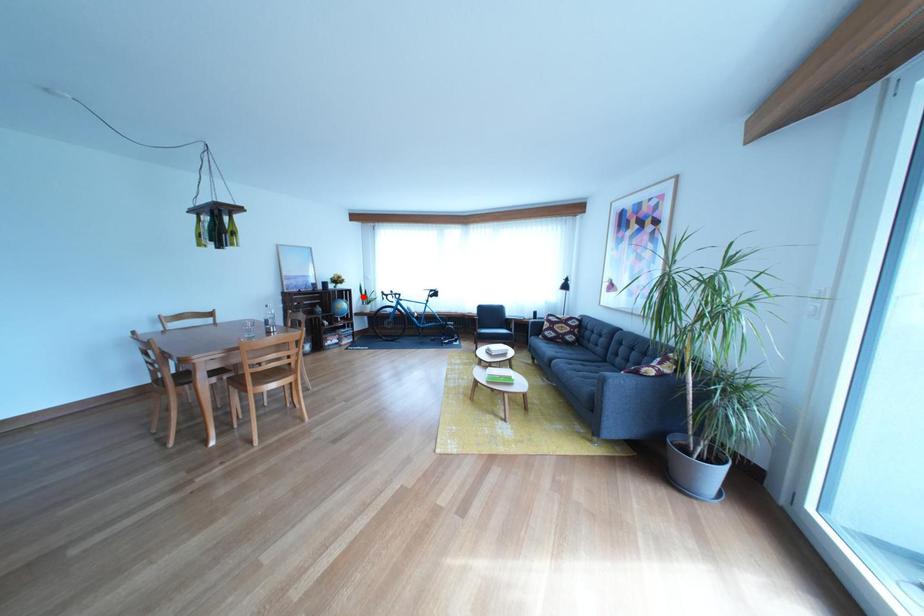
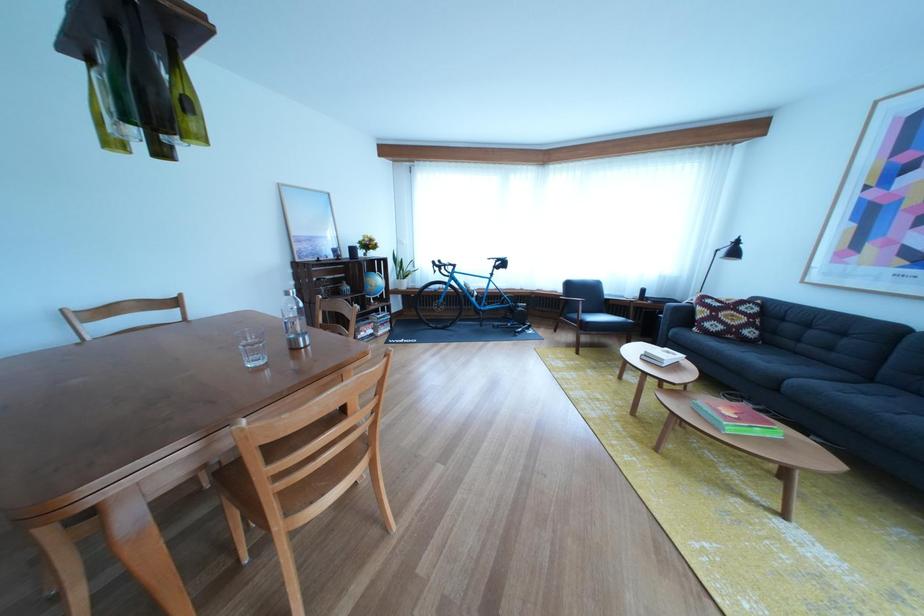
Question: I am providing you with two images of the same scene from different viewpoints. Given a red point in image1, look at the same physical point in image2. Is it:

Choices:
 (A) Closer to the viewpoint
 (B) Farther from the viewpoint

Answer: (A)